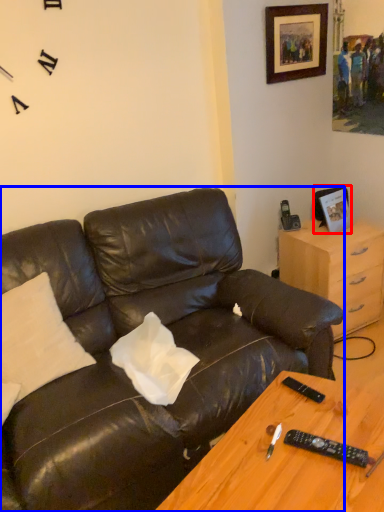
Question: Which object is further to the camera taking this photo, picture frame (highlighted by a red box) or studio couch (highlighted by a blue box)?

Choices:
 (A) picture frame
 (B) studio couch

Answer: (A)